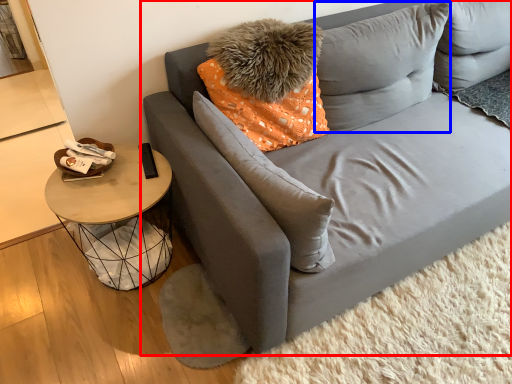
Question: Which point is further to the camera, studio couch (highlighted by a red box) or pillow (highlighted by a blue box)?

Choices:
 (A) studio couch
 (B) pillow

Answer: (B)